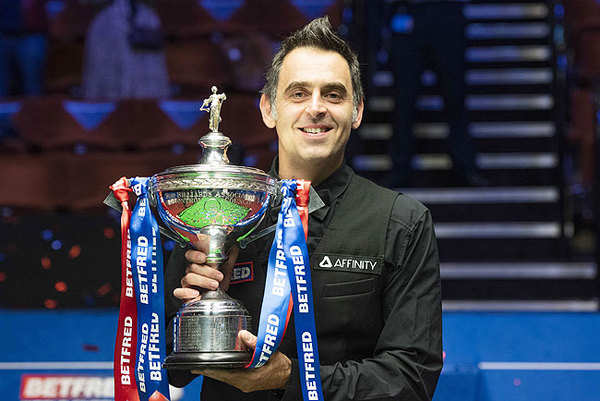
Where is `trophy`? The width and height of the screenshot is (600, 401). trophy is located at coordinates (212, 215).